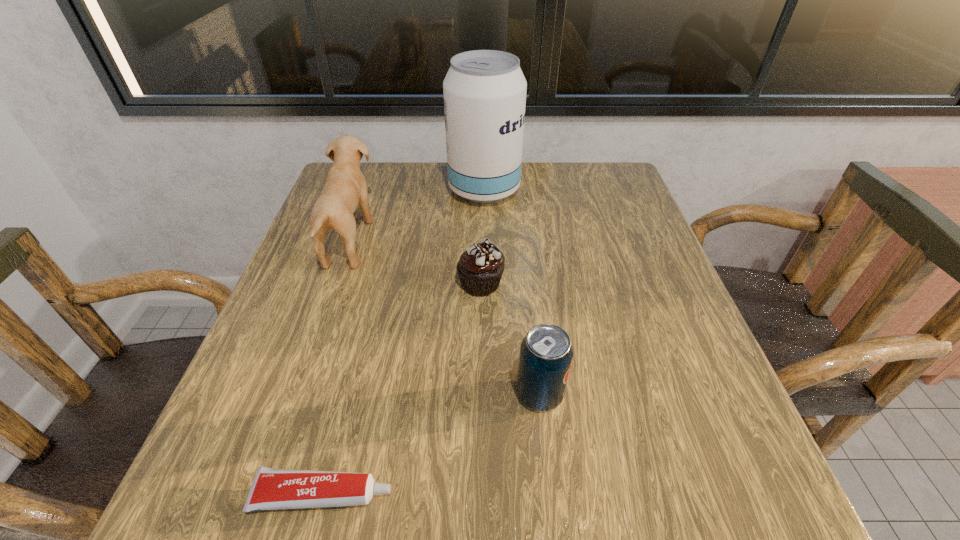
You are a GUI agent. You are given a task and a screenshot of the screen. Output one action in this format:
    pyautogui.click(x=<x>, y=<y>)
    Task: Click on the vacant area that lies between the alcohol and the nearest object
    Image resolution: width=960 pixels, height=540 pixels.
    Given the screenshot: What is the action you would take?
    pyautogui.click(x=404, y=342)

Identify the location of free space between the alcohol and the fourth tallest object. Image resolution: width=960 pixels, height=540 pixels. (482, 237).

Find the location of `free space between the toothpaste and the tallest object`. free space between the toothpaste and the tallest object is located at coordinates (404, 342).

I want to click on vacant region between the toothpaste and the cupcake, so click(x=402, y=389).

Identify the location of object that stands as the third closest to the fourth farthest object. The image size is (960, 540). (346, 187).

Point out which object is positioned as the third nearest to the second shortest object. Please provide its 2D coordinates. Your answer should be formatted as a tuple, i.e. [(x, y)], where the tuple contains the x and y coordinates of a point satisfying the conditions above.

[(484, 91)]

I want to click on free space in the image that satisfies the following two spatial constraints: 1. on the left side of the puppy; 2. on the left side of the cupcake, so click(335, 284).

Where is `free space that satisfies the following two spatial constraints: 1. on the left side of the second shortest object; 2. on the right side of the second tallest object`? The height and width of the screenshot is (540, 960). free space that satisfies the following two spatial constraints: 1. on the left side of the second shortest object; 2. on the right side of the second tallest object is located at coordinates tap(335, 284).

The height and width of the screenshot is (540, 960). Find the location of `vacant space that satisfies the following two spatial constraints: 1. on the front side of the third tallest object; 2. at the nozzle of the nearest object`. vacant space that satisfies the following two spatial constraints: 1. on the front side of the third tallest object; 2. at the nozzle of the nearest object is located at coordinates point(551,495).

Identify the location of vacant area that satisfies the following two spatial constraints: 1. on the left side of the second tallest object; 2. on the left side of the fourth farthest object. The image size is (960, 540). (297, 394).